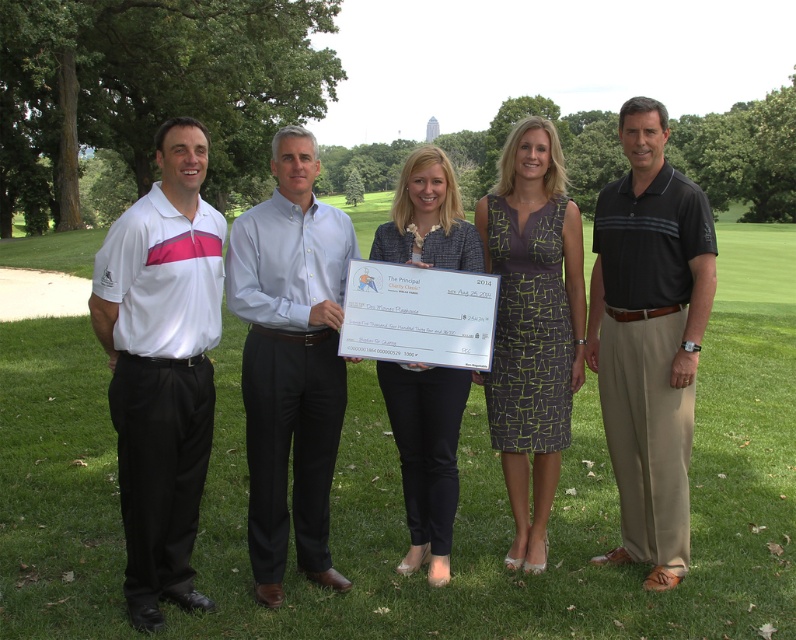
You are a photographer setting up for an outdoor event on a golf course. You notice the green grass at center and the printed fabric dress at center in the scene. Which object is higher in height?

The green grass at center is taller than the printed fabric dress at center according to the description provided.

You are a photographer setting up for a group photo. You need to arrange the subjects so that the white smooth polo shirt at left and the printed fabric dress at center are positioned correctly according to their original placement. Which subject should be placed to the left of the other?

Answer: The white smooth polo shirt at left should be placed to the left of the printed fabric dress at center because the description states that the white smooth polo shirt at left is to the left of the printed fabric dress at center.